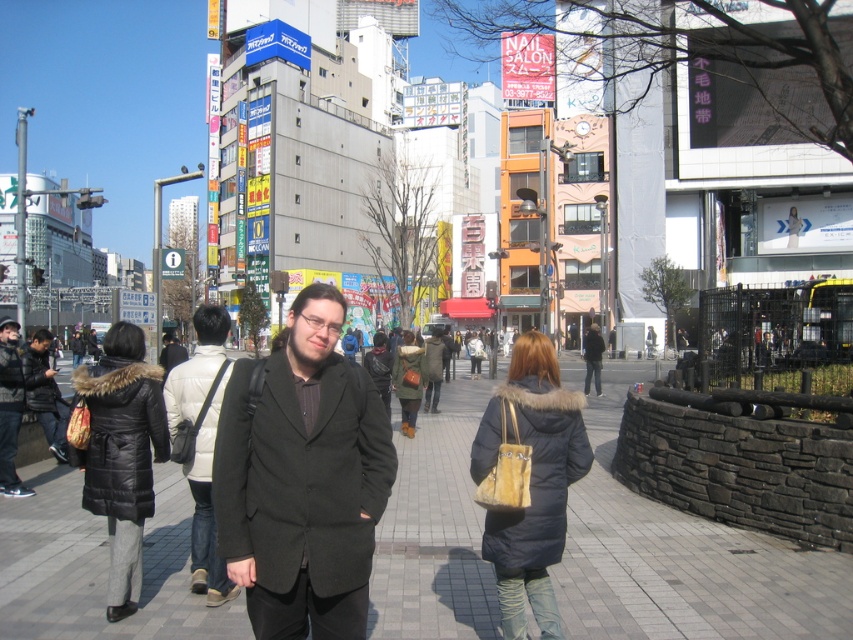
You are a photographer trying to capture the man in the dark gray wool coat at center without including the brick pavement at center in the frame. Is this possible given their relative sizes?

The brick pavement at center is not as tall as the dark gray wool coat at center, so it is possible to capture the man in the dark gray wool coat at center without including the brick pavement at center by focusing on the upper part of the coat where the pavement does not reach.

You are a fashion designer observing a man wearing a dark gray wool coat at center and a black matte jacket at center. Which piece of clothing is positioned higher on his body?

The dark gray wool coat at center is above the black matte jacket at center, so the dark gray wool coat at center is positioned higher on his body.